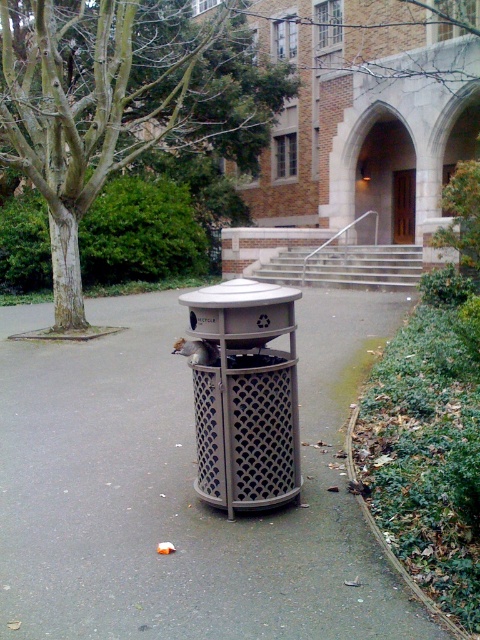
Is point (367, 296) positioned behind point (248, 138)?

No, (367, 296) is closer to viewer.

The height and width of the screenshot is (640, 480). Describe the element at coordinates (180, 490) in the screenshot. I see `brushed metal trash can at center` at that location.

Who is more distant from viewer, (x=175, y=420) or (x=66, y=122)?

Positioned behind is point (x=66, y=122).

Where is `brushed metal trash can at center`? The height and width of the screenshot is (640, 480). brushed metal trash can at center is located at coordinates (180, 490).

Is green leafy tree at center to the right of metallic mesh trash can at center from the viewer's perspective?

Incorrect, green leafy tree at center is not on the right side of metallic mesh trash can at center.

Between point (183, 97) and point (294, 422), which one is positioned behind?

Point (183, 97)

Which is in front, point (86, 83) or point (279, 420)?

Positioned in front is point (279, 420).

Find the location of a particular element. The image size is (480, 640). green leafy tree at center is located at coordinates 121,102.

Who is higher up, brushed metal trash can at center or metallic mesh trash can at center?

Positioned higher is metallic mesh trash can at center.

Does brushed metal trash can at center have a lesser width compared to metallic mesh trash can at center?

In fact, brushed metal trash can at center might be wider than metallic mesh trash can at center.

Does point (55, 547) lie in front of point (207, 369)?

Yes.

Image resolution: width=480 pixels, height=640 pixels. I want to click on brushed metal trash can at center, so click(x=180, y=490).